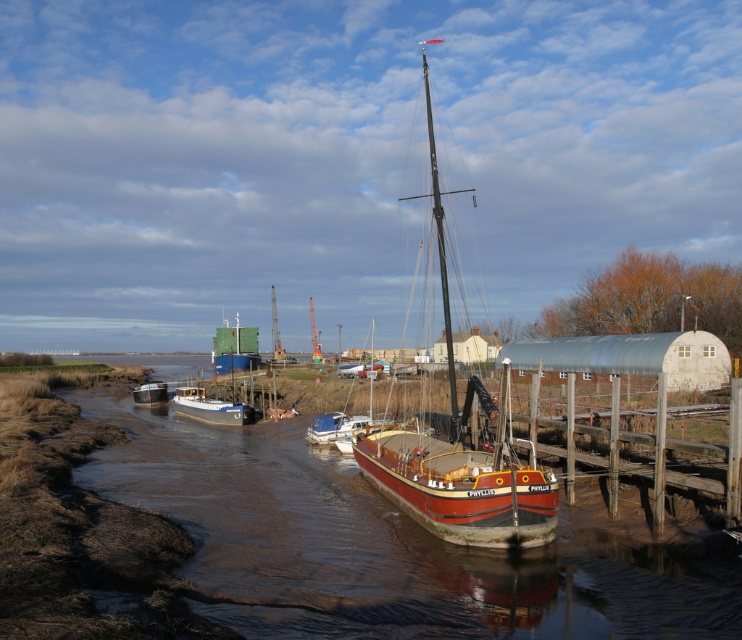
Question: Does wooden sailboat at center have a greater width compared to white plastic dinghy at center?

Choices:
 (A) no
 (B) yes

Answer: (B)

Question: Which object is positioned closest to the metallic gray dock at center?

Choices:
 (A) wooden sailboat at center
 (B) white glossy boat at center

Answer: (B)

Question: Does wooden sailboat at center have a smaller size compared to white plastic dinghy at center?

Choices:
 (A) yes
 (B) no

Answer: (B)

Question: Which object is closer to the camera taking this photo?

Choices:
 (A) brown mud at lower left
 (B) wooden sailboat at center
 (C) smooth wood mast at center

Answer: (A)

Question: Does metallic gray dock at center have a larger size compared to white glossy boat at center?

Choices:
 (A) yes
 (B) no

Answer: (A)

Question: Which object is positioned farthest from the white glossy boat at center?

Choices:
 (A) smooth wood mast at center
 (B) metallic gray boat at lower left
 (C) white plastic dinghy at center
 (D) wooden sailboat at center

Answer: (B)